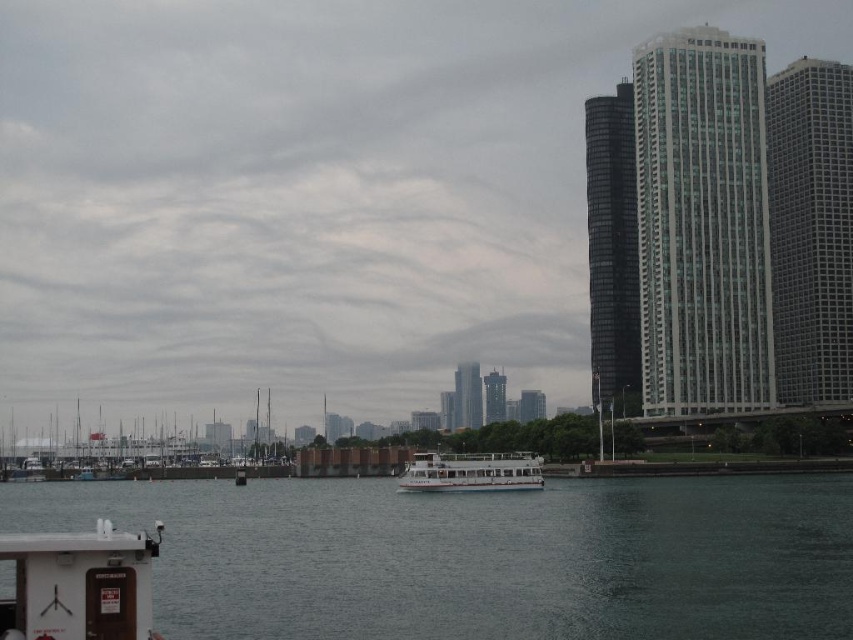
You are standing at the point marked as point (123, 486) and want to take a photo of the city skyline. The camera you are using has a maximum zoom range of 100 meters. Can you capture the entire city skyline in your photo without moving closer?

The distance between you at point (123, 486) and the viewer is 132.79 meters. Since your camera can only zoom up to 100 meters, you cannot capture the entire city skyline without moving closer.

You are standing at the waterfront and see two points in the scene. The first point is at coordinates point (112,516) and the second is at point (485,467). Which point is closer to you?

Point (112,516) is in front of point (485,467), so it is closer to you.